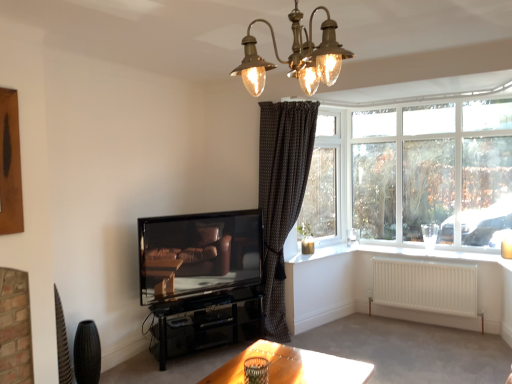
The height and width of the screenshot is (384, 512). Find the location of `matte black television at center`. matte black television at center is located at coordinates (199, 253).

This screenshot has width=512, height=384. Find the location of `black textured curtain at upper right`. black textured curtain at upper right is located at coordinates (323, 183).

What do you see at coordinates (405, 253) in the screenshot? The width and height of the screenshot is (512, 384). I see `white painted wood at lower right` at bounding box center [405, 253].

Find the location of a particular element. The height and width of the screenshot is (384, 512). brass textured chandelier at upper center is located at coordinates (296, 56).

This screenshot has height=384, width=512. I want to click on matte black television at center, so click(x=199, y=253).

The width and height of the screenshot is (512, 384). I want to click on window screen above the white matte radiator at lower right (from the image's perspective), so click(323, 183).

From a real-world perspective, is black textured curtain at upper right above or below white matte radiator at lower right?

black textured curtain at upper right is above white matte radiator at lower right.

Can you confirm if black textured curtain at upper right is positioned to the left of white matte radiator at lower right?

Yes, black textured curtain at upper right is to the left of white matte radiator at lower right.

Between black textured curtain at upper right and white matte radiator at lower right, which one has larger width?

With larger width is white matte radiator at lower right.

From the image's perspective, which is below, white matte radiator at lower right or black textured curtain at upper right?

white matte radiator at lower right, from the image's perspective.

What are the coordinates of `radiator on the right of the black textured curtain at upper right` in the screenshot? It's located at (425, 286).

Is white matte radiator at lower right thinner than black textured curtain at upper right?

No, white matte radiator at lower right is not thinner than black textured curtain at upper right.

Consider the image. Between white matte radiator at lower right and black textured curtain at upper right, which one has more height?

Standing taller between the two is black textured curtain at upper right.

Is brown dotted fabric curtain at center closer to camera compared to matte black television at center?

No, it is not.

Between brown dotted fabric curtain at center and matte black television at center, which one has larger width?

Wider between the two is brown dotted fabric curtain at center.

How different are the orientations of brown dotted fabric curtain at center and matte black television at center in degrees?

The angle between the facing direction of brown dotted fabric curtain at center and the facing direction of matte black television at center is 16.4 degrees.

From their relative heights in the image, would you say brown dotted fabric curtain at center is taller or shorter than matte black television at center?

brown dotted fabric curtain at center is taller than matte black television at center.

Could you tell me if white painted wood at lower right is facing white glass window at upper right?

No, white painted wood at lower right is not facing towards white glass window at upper right.

Looking at this image, from the image's perspective, which one is positioned lower, white painted wood at lower right or white glass window at upper right?

white painted wood at lower right.

Can you confirm if white painted wood at lower right is shorter than white glass window at upper right?

Indeed, white painted wood at lower right has a lesser height compared to white glass window at upper right.

Relative to white glass window at upper right, is white painted wood at lower right in front or behind?

white painted wood at lower right is in front of white glass window at upper right.

Considering the sizes of objects white painted wood at lower right and brass textured chandelier at upper center in the image provided, who is wider, white painted wood at lower right or brass textured chandelier at upper center?

brass textured chandelier at upper center.

From the image's perspective, which object appears higher, white painted wood at lower right or brass textured chandelier at upper center?

brass textured chandelier at upper center is shown above in the image.

Does point (341, 247) appear closer or farther from the camera than point (337, 54)?

Point (341, 247) is positioned farther from the camera compared to point (337, 54).

From a real-world perspective, which object stands above the other?

From a 3D spatial view, brass textured chandelier at upper center is above.

From a real-world perspective, which object rests below the other?

From a 3D spatial view, white glass window at upper right is below.

Is white glass window at upper right wider or thinner than brass textured chandelier at upper center?

Considering their sizes, white glass window at upper right looks slimmer than brass textured chandelier at upper center.

Which of these two, white glass window at upper right or brass textured chandelier at upper center, stands taller?

Standing taller between the two is white glass window at upper right.

What's the angular difference between white glass window at upper right and brass textured chandelier at upper center's facing directions?

The facing directions of white glass window at upper right and brass textured chandelier at upper center are 90.1 degrees apart.

Based on the photo, would you say black textured curtain at upper right is outside matte black television at center?

Yes, black textured curtain at upper right is not within matte black television at center.

Is matte black television at center at the back of black textured curtain at upper right?

No, black textured curtain at upper right's orientation is not away from matte black television at center.

This screenshot has height=384, width=512. What are the coordinates of `radiator directly beneath the black textured curtain at upper right (from a real-world perspective)` in the screenshot? It's located at (425, 286).

Identify the location of window screen to the left of white matte radiator at lower right. (323, 183).

Considering their positions, is white glass window at upper right positioned further to brown dotted fabric curtain at center than brass textured chandelier at upper center?

Based on the image, brass textured chandelier at upper center appears to be further to brown dotted fabric curtain at center.

Estimate the real-world distances between objects in this image. Which object is closer to brown dotted fabric curtain at center, brass textured chandelier at upper center or matte black television at center?

matte black television at center lies closer to brown dotted fabric curtain at center than the other object.

Estimate the real-world distances between objects in this image. Which object is closer to white glass window at upper right, black textured curtain at upper right or brass textured chandelier at upper center?

The object closer to white glass window at upper right is black textured curtain at upper right.

Estimate the real-world distances between objects in this image. Which object is closer to black textured curtain at upper right, brown dotted fabric curtain at center or white glass window at upper right?

white glass window at upper right.

Estimate the real-world distances between objects in this image. Which object is closer to white painted wood at lower right, white matte radiator at lower right or black textured curtain at upper right?

white matte radiator at lower right is positioned closer to the anchor white painted wood at lower right.

Considering their positions, is black textured curtain at upper right positioned further to white matte radiator at lower right than brown dotted fabric curtain at center?

brown dotted fabric curtain at center is further to white matte radiator at lower right.

Looking at the image, which one is located closer to white painted wood at lower right, matte black television at center or white matte radiator at lower right?

Based on the image, white matte radiator at lower right appears to be nearer to white painted wood at lower right.

Which object lies further to the anchor point white matte radiator at lower right, black textured curtain at upper right or white painted wood at lower right?

black textured curtain at upper right is further to white matte radiator at lower right.

The height and width of the screenshot is (384, 512). In order to click on window sill positioned between brass textured chandelier at upper center and white glass window at upper right from near to far in this screenshot , I will do pos(405,253).

I want to click on television located between brass textured chandelier at upper center and brown dotted fabric curtain at center in the depth direction, so click(199, 253).

At what (x,y) coordinates should I click in order to perform the action: click on television between brass textured chandelier at upper center and white matte radiator at lower right in the front-back direction. Please return your answer as a coordinate pair (x, y). Image resolution: width=512 pixels, height=384 pixels. Looking at the image, I should click on (199, 253).

Where is `radiator between brown dotted fabric curtain at center and white glass window at upper right in the horizontal direction`? Image resolution: width=512 pixels, height=384 pixels. radiator between brown dotted fabric curtain at center and white glass window at upper right in the horizontal direction is located at coordinates (425, 286).